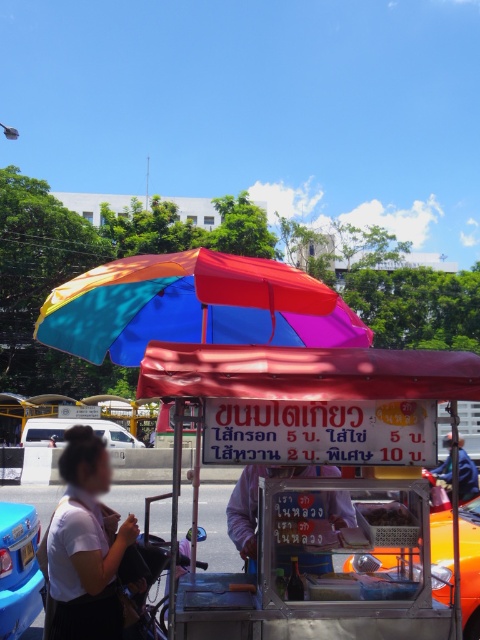
Does orange plastic cart at lower right have a lesser width compared to dark brown matte food at center?

No.

Which is below, orange plastic cart at lower right or dark brown matte food at center?

orange plastic cart at lower right

Is point (451, 433) positioned behind point (371, 524)?

No, (451, 433) is in front of (371, 524).

Find the location of a particular element. orange plastic cart at lower right is located at coordinates (466, 474).

Can you confirm if white matte shirt at lower left is positioned below white van at center?

No.

Does point (107, 508) come farther from viewer compared to point (58, 419)?

No, (107, 508) is in front of (58, 419).

I want to click on white matte shirt at lower left, so click(84, 547).

Between point (274, 364) and point (398, 566), which one is positioned in front?

Point (274, 364) is in front.

Where is `metallic silver food cart at center`? Image resolution: width=480 pixels, height=640 pixels. metallic silver food cart at center is located at coordinates (303, 376).